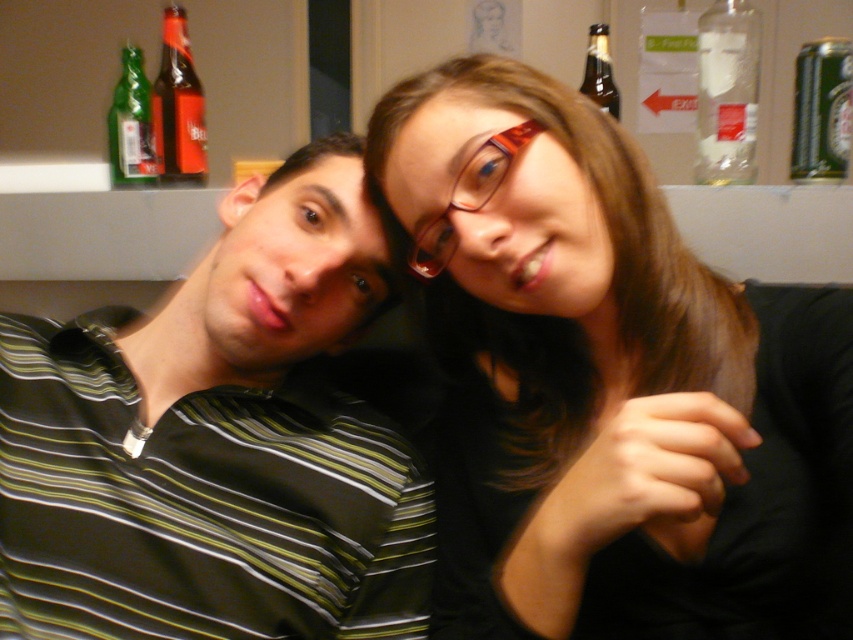
You are organizing a small party and need to arrange drinks on a narrow shelf. You have a green metallic can at upper right and a brown glass bottle at upper right. Which one will fit better in the narrow space?

The green metallic can at upper right has a smaller width than the brown glass bottle at upper right, so it will fit better in the narrow space.

You are a photographer trying to capture a candid shot of the striped cotton shirt at left and the green glass bottle at upper left. If you want to ensure both subjects are in focus, which one should you adjust your camera focus to prioritize based on their sizes?

The striped cotton shirt at left is wider than the green glass bottle at upper left. Since the shirt is larger in width, you should prioritize focusing on it to ensure both are in focus.

You are holding a 12 inch ruler and want to measure the distance from the camera to the point at coordinates (492, 237). What is the measured distance?

The distance between the point at coordinates (492, 237) and the camera is 23.25 inches.